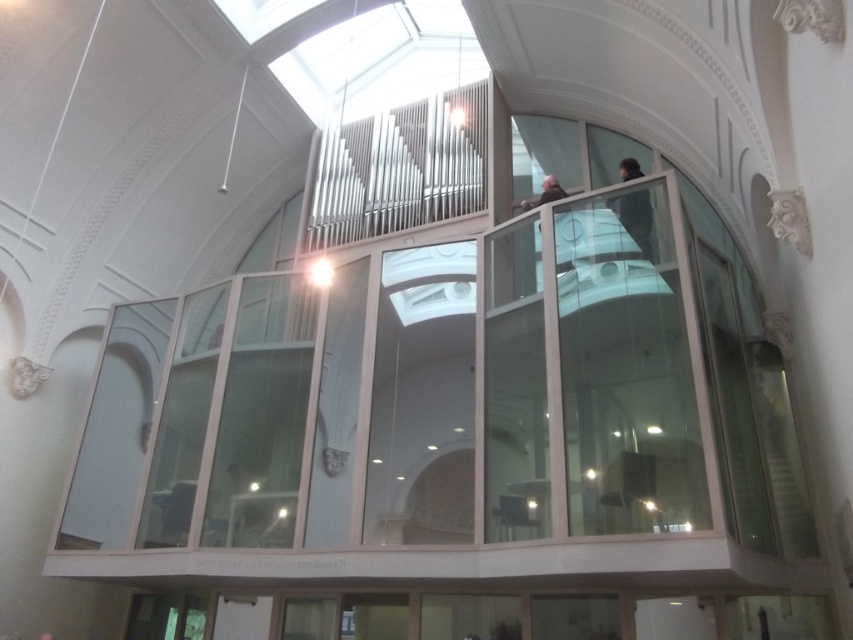
Which is in front, point (651, 211) or point (527, 205)?

Point (651, 211)

Measure the distance from dark gray fabric jacket at upper right to dark brown leather jacket at upper center.

A distance of 4.62 feet exists between dark gray fabric jacket at upper right and dark brown leather jacket at upper center.

Who is more distant from viewer, (647,198) or (523,200)?

Positioned behind is point (523,200).

Locate an element on the screen. dark gray fabric jacket at upper right is located at coordinates (636, 220).